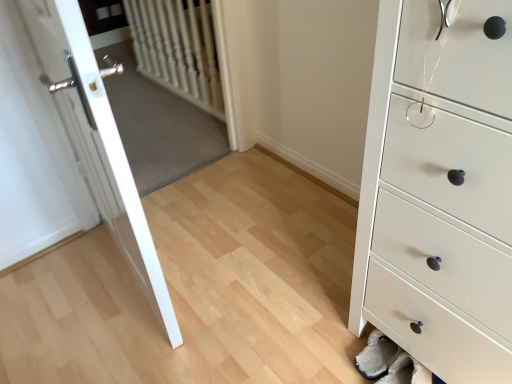
You are a GUI agent. You are given a task and a screenshot of the screen. Output one action in this format:
    pyautogui.click(x=<x>, y=<y>)
    Task: Click on the vacant area that is situated to the right of white glossy door at left
    The width and height of the screenshot is (512, 384).
    Given the screenshot: What is the action you would take?
    pyautogui.click(x=244, y=257)